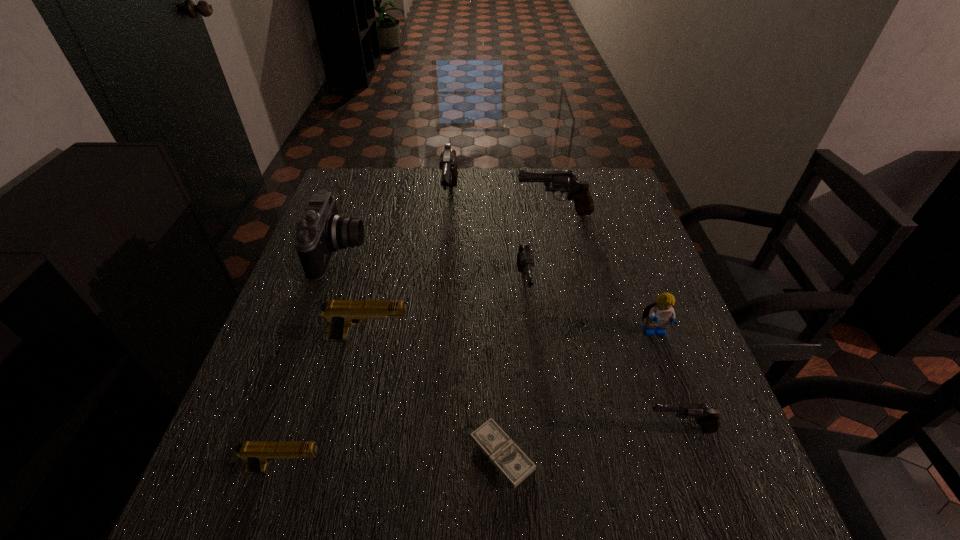
Locate an element on the screen. the biggest gray pistol is located at coordinates (448, 165).

I want to click on the leftmost gray pistol, so click(448, 165).

Identify the location of black camera. The image size is (960, 540). (321, 231).

I want to click on the fifth shortest pistol, so click(x=564, y=181).

The height and width of the screenshot is (540, 960). Find the location of `the fourth nearest pistol`. the fourth nearest pistol is located at coordinates (525, 261).

This screenshot has width=960, height=540. I want to click on the second smallest gray pistol, so click(x=525, y=261).

Where is `Lego`? Image resolution: width=960 pixels, height=540 pixels. Lego is located at coordinates (659, 314).

The height and width of the screenshot is (540, 960). I want to click on the fourth farthest pistol, so click(x=340, y=314).

Image resolution: width=960 pixels, height=540 pixels. Find the location of `the bigger tan pistol`. the bigger tan pistol is located at coordinates (340, 314).

Where is `the nearest gray pistol`? This screenshot has width=960, height=540. the nearest gray pistol is located at coordinates (708, 417).